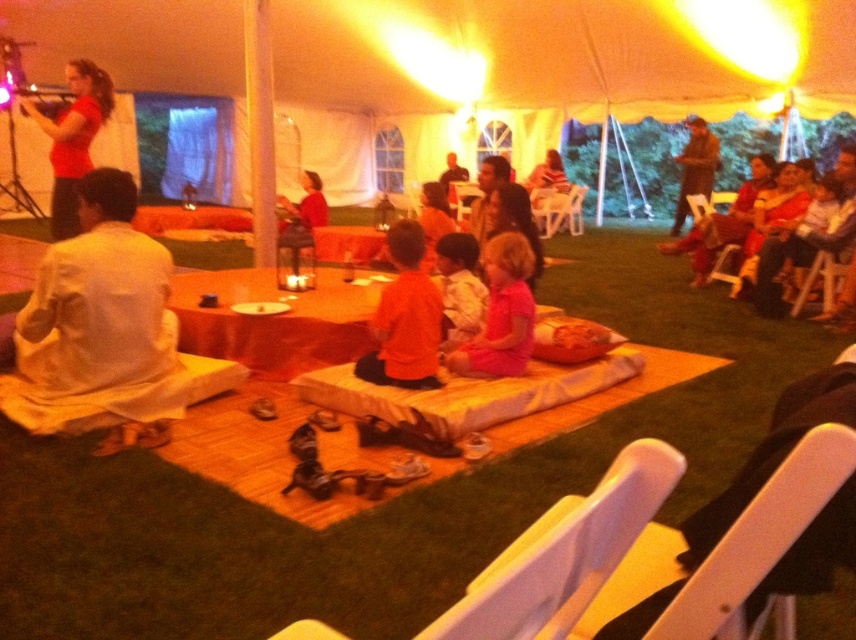
Question: Is matte red shirt at upper left wider than white cotton shirt at center?

Choices:
 (A) yes
 (B) no

Answer: (A)

Question: Is orange cotton shirt at center above matte pink dress at right?

Choices:
 (A) yes
 (B) no

Answer: (B)

Question: Estimate the real-world distances between objects in this image. Which object is farther from the white cotton shirt at center?

Choices:
 (A) matte red shirt at upper left
 (B) brown leather jacket at upper right
 (C) matte pink dress at right

Answer: (B)

Question: Which point is farther to the camera?

Choices:
 (A) brown leather jacket at upper right
 (B) orange cotton shirt at center

Answer: (A)

Question: Observing the image, what is the correct spatial positioning of white cotton shirt at center in reference to brown leather jacket at upper right?

Choices:
 (A) above
 (B) below

Answer: (B)

Question: Which is farther from the brown leather jacket at upper right?

Choices:
 (A) matte pink dress at right
 (B) pink matte dress at center
 (C) matte red shirt at center
 (D) matte red shirt at upper left

Answer: (D)